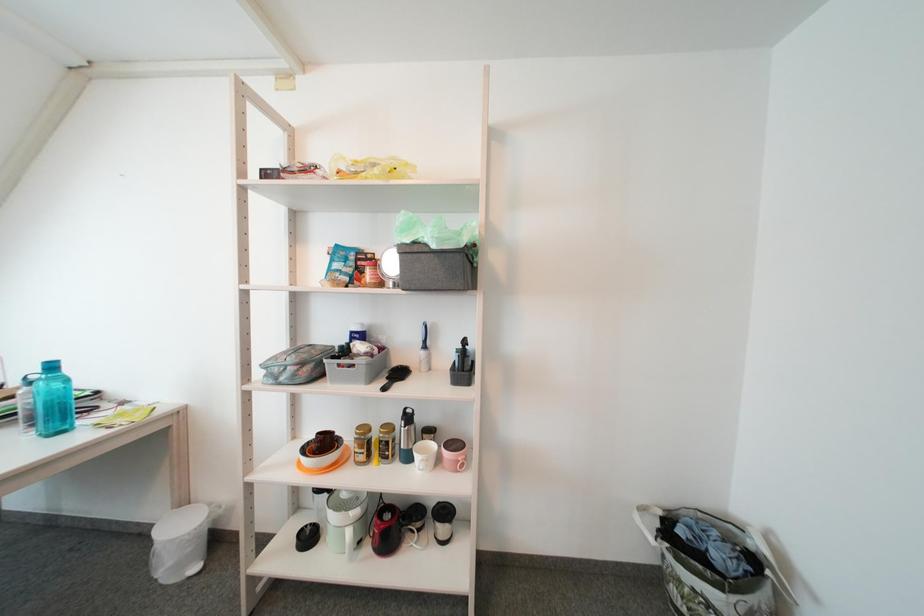
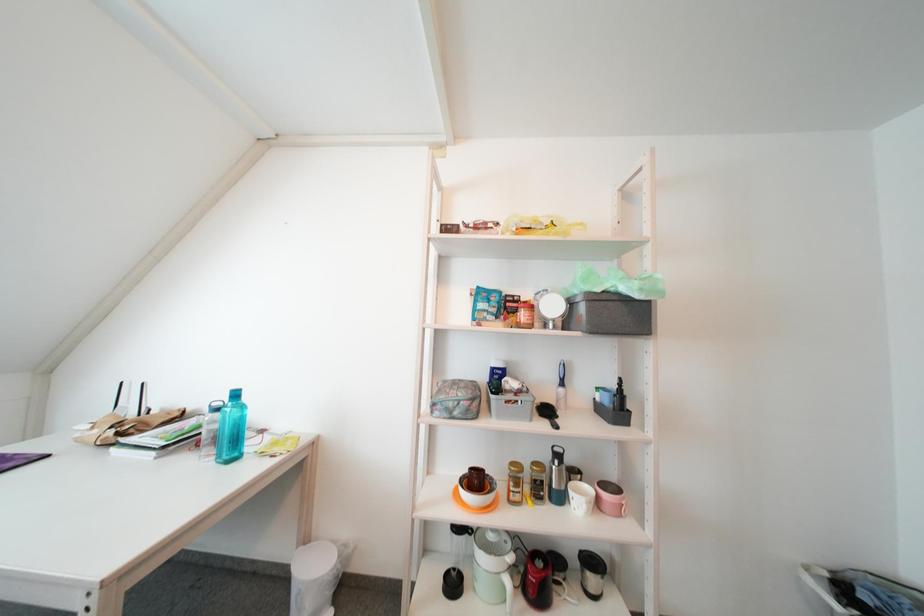
Question: Based on the continuous images, in which direction is the camera rotating? Reply with the corresponding letter.

Choices:
 (A) Left
 (B) Right
 (C) Up
 (D) Down

Answer: (C)